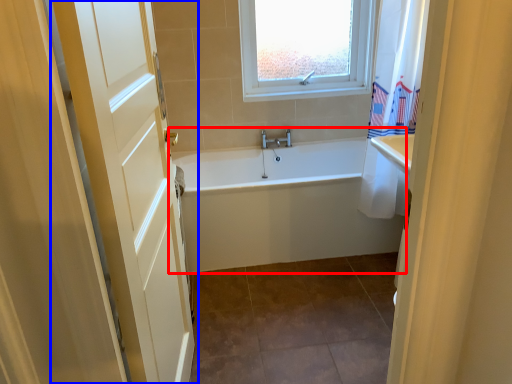
Question: Which object is closer to the camera taking this photo, bathtub (highlighted by a red box) or door (highlighted by a blue box)?

Choices:
 (A) bathtub
 (B) door

Answer: (B)